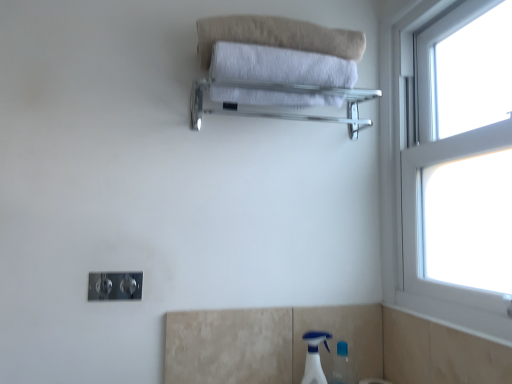
Question: Is white plastic spray bottle at lower right wider than clear glass towel rack at upper center?

Choices:
 (A) yes
 (B) no

Answer: (B)

Question: Is white plastic spray bottle at lower right oriented towards clear glass towel rack at upper center?

Choices:
 (A) yes
 (B) no

Answer: (B)

Question: Is there a large distance between white plastic spray bottle at lower right and clear glass towel rack at upper center?

Choices:
 (A) no
 (B) yes

Answer: (A)

Question: Can you confirm if white plastic spray bottle at lower right is smaller than clear glass towel rack at upper center?

Choices:
 (A) no
 (B) yes

Answer: (B)

Question: Considering the relative positions of white plastic spray bottle at lower right and clear glass towel rack at upper center in the image provided, is white plastic spray bottle at lower right to the right of clear glass towel rack at upper center from the viewer's perspective?

Choices:
 (A) yes
 (B) no

Answer: (A)

Question: Could clear glass towel rack at upper center be considered to be inside white plastic spray bottle at lower right?

Choices:
 (A) no
 (B) yes

Answer: (A)

Question: Is beige cotton towel at upper center completely or partially outside of white plastic spray bottle at lower right?

Choices:
 (A) yes
 (B) no

Answer: (A)

Question: Considering the relative sizes of beige cotton towel at upper center and white plastic spray bottle at lower right in the image provided, is beige cotton towel at upper center taller than white plastic spray bottle at lower right?

Choices:
 (A) no
 (B) yes

Answer: (A)

Question: From a real-world perspective, is beige cotton towel at upper center on white plastic spray bottle at lower right?

Choices:
 (A) yes
 (B) no

Answer: (A)

Question: Is beige cotton towel at upper center in front of white plastic spray bottle at lower right?

Choices:
 (A) yes
 (B) no

Answer: (A)

Question: Can white plastic spray bottle at lower right be found inside beige cotton towel at upper center?

Choices:
 (A) no
 (B) yes

Answer: (A)

Question: Is beige cotton towel at upper center beside white plastic spray bottle at lower right?

Choices:
 (A) yes
 (B) no

Answer: (B)

Question: Is clear glass towel rack at upper center outside of white soft towel at upper center?

Choices:
 (A) no
 (B) yes

Answer: (B)